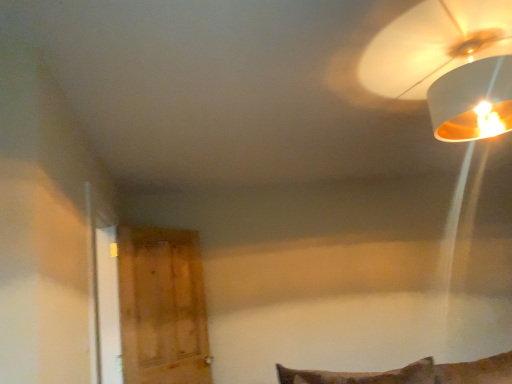
Question: Does wooden door at left come in front of white matte lampshade at upper right?

Choices:
 (A) yes
 (B) no

Answer: (B)

Question: Is wooden door at left shorter than white matte lampshade at upper right?

Choices:
 (A) no
 (B) yes

Answer: (A)

Question: Is wooden door at left not within white matte lampshade at upper right?

Choices:
 (A) yes
 (B) no

Answer: (A)

Question: Considering the relative positions of wooden door at left and white matte lampshade at upper right in the image provided, is wooden door at left behind white matte lampshade at upper right?

Choices:
 (A) yes
 (B) no

Answer: (A)

Question: Is wooden door at left with white matte lampshade at upper right?

Choices:
 (A) no
 (B) yes

Answer: (A)

Question: Is wooden door at left facing away from white matte lampshade at upper right?

Choices:
 (A) yes
 (B) no

Answer: (B)

Question: Is white matte lampshade at upper right positioned before wooden door at left?

Choices:
 (A) no
 (B) yes

Answer: (B)

Question: Considering the relative sizes of white matte lampshade at upper right and wooden door at left in the image provided, is white matte lampshade at upper right bigger than wooden door at left?

Choices:
 (A) no
 (B) yes

Answer: (B)

Question: Is white matte lampshade at upper right taller than wooden door at left?

Choices:
 (A) yes
 (B) no

Answer: (B)

Question: Is white matte lampshade at upper right aimed at wooden door at left?

Choices:
 (A) yes
 (B) no

Answer: (B)

Question: Is wooden door at left at the back of white matte lampshade at upper right?

Choices:
 (A) no
 (B) yes

Answer: (A)

Question: Is white matte lampshade at upper right far from wooden door at left?

Choices:
 (A) no
 (B) yes

Answer: (B)

Question: Is wooden door at left in front of or behind white matte lampshade at upper right in the image?

Choices:
 (A) behind
 (B) front

Answer: (A)